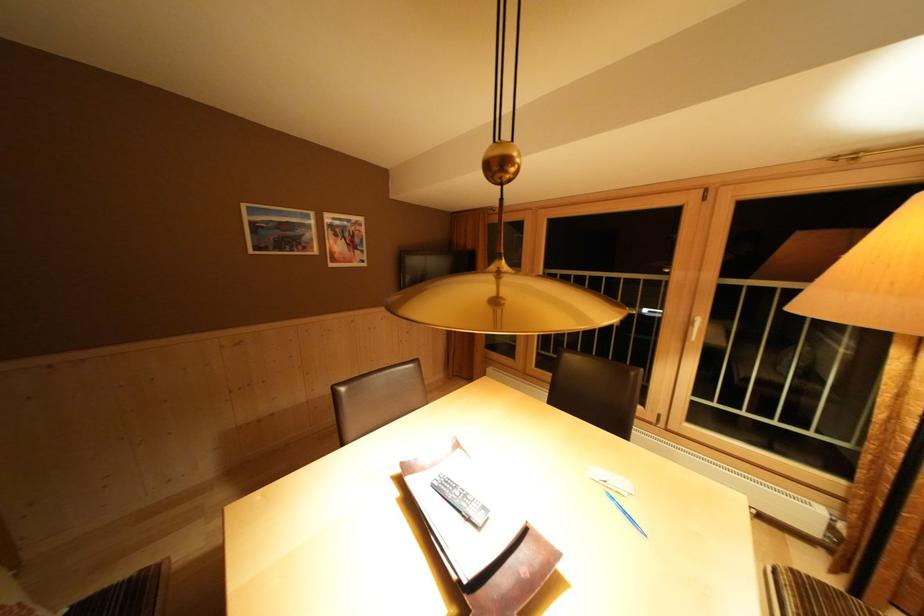
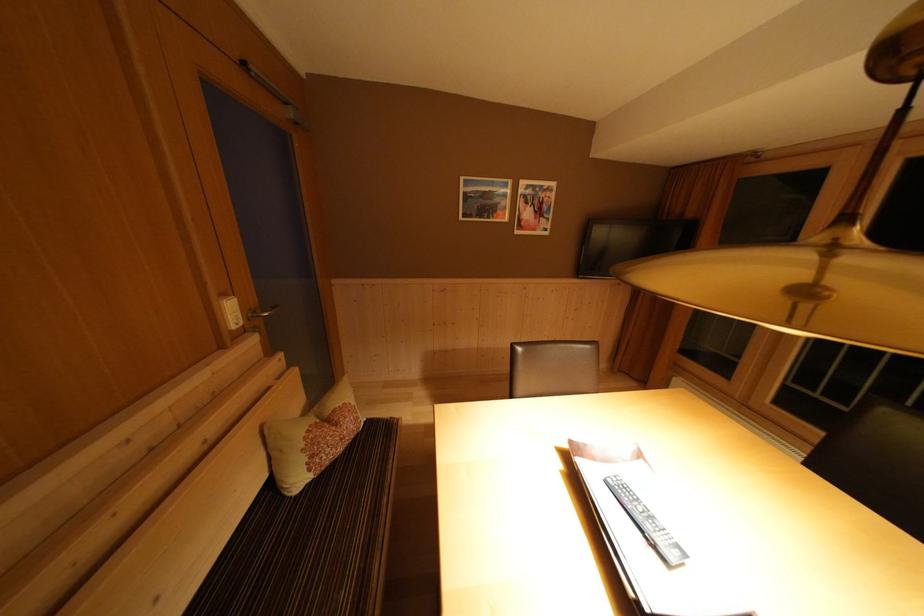
Locate, in the second image, the point that corresponds to (x=442, y=488) in the first image.

(617, 485)